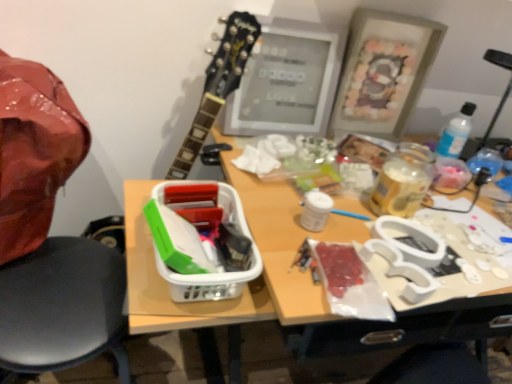
Question: Relative to black plastic chair at left, is matte gray frame at upper center in front or behind?

Choices:
 (A) behind
 (B) front

Answer: (A)

Question: Looking at their shapes, would you say matte gray frame at upper center is wider or thinner than black plastic chair at left?

Choices:
 (A) wide
 (B) thin

Answer: (B)

Question: Based on their relative distances, which object is farther from the wooden picture frame at upper right?

Choices:
 (A) white plastic lunch box at center
 (B) black plastic chair at left
 (C) matte gray frame at upper center

Answer: (B)

Question: Which object is positioned farthest from the black plastic chair at left?

Choices:
 (A) wooden picture frame at upper right
 (B) matte gray frame at upper center
 (C) white plastic lunch box at center

Answer: (A)